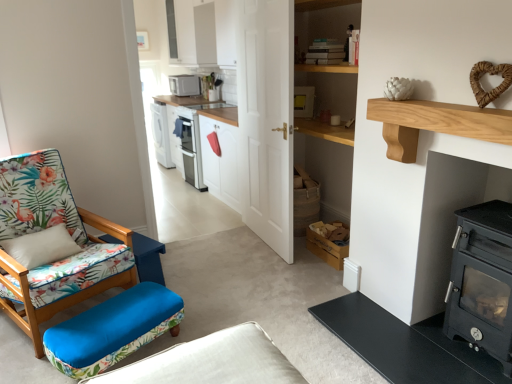
You are a GUI agent. You are given a task and a screenshot of the screen. Output one action in this format:
    pyautogui.click(x=<x>, y=<y>)
    Task: Click on the vacant space situated on the left part of black matte wood burning stove at right
    
    Given the screenshot: What is the action you would take?
    coord(416,349)